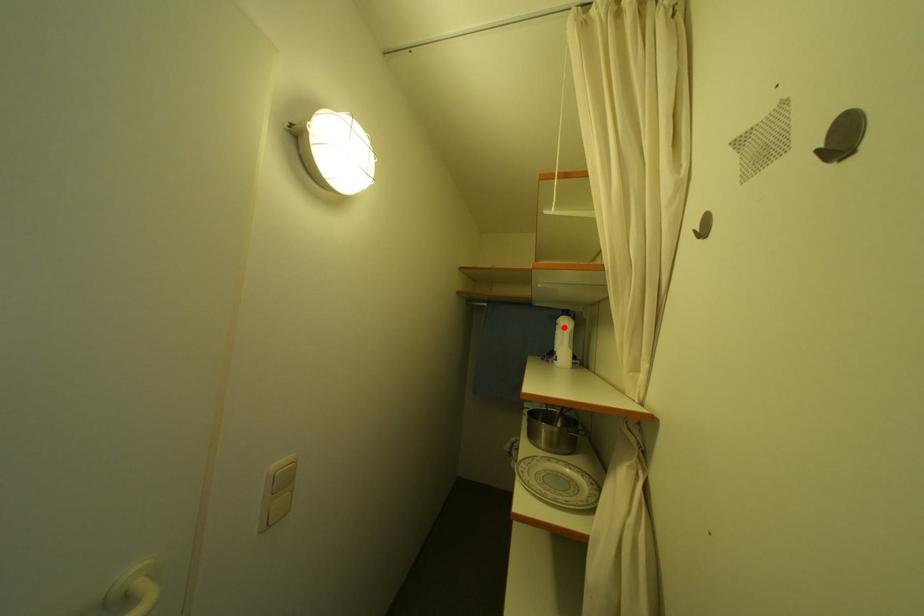
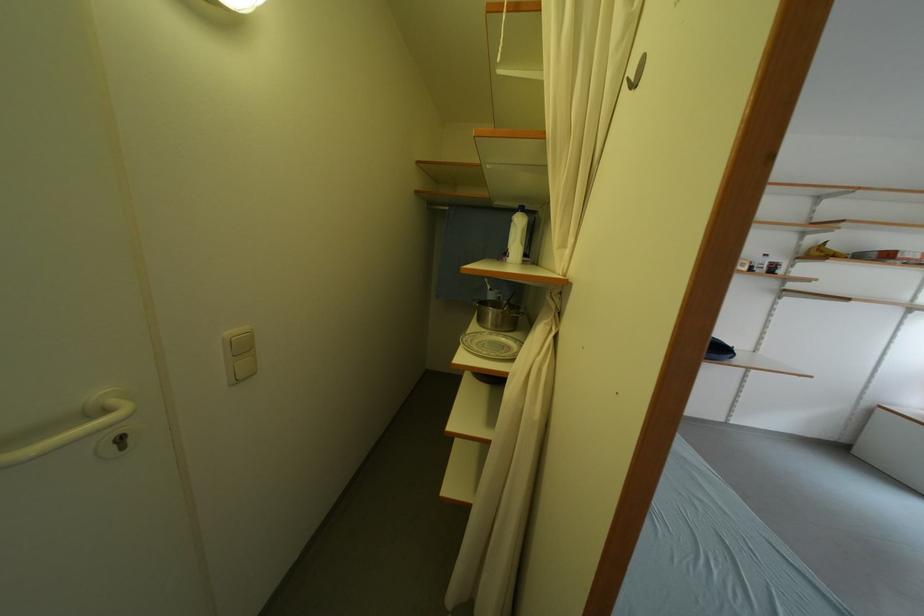
Locate, in the second image, the point that corresponds to the highlighted location in the first image.

(518, 225)